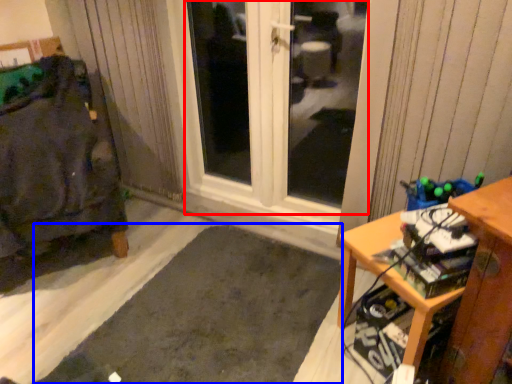
Question: Which of the following is the farthest to the observer, window (highlighted by a red box) or doormat (highlighted by a blue box)?

Choices:
 (A) window
 (B) doormat

Answer: (A)